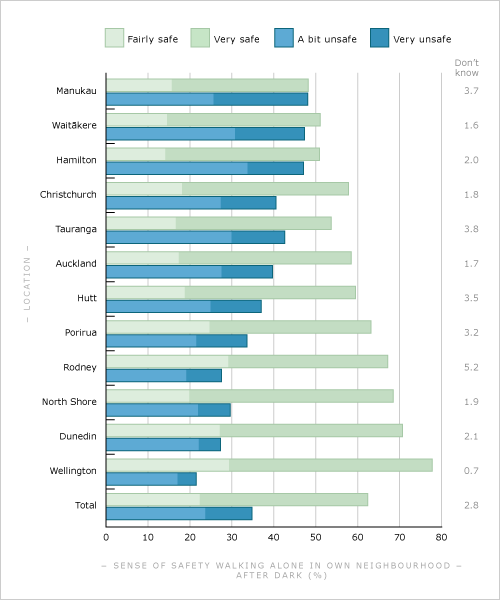
The image size is (500, 600). I want to click on bars, so click(x=237, y=86), click(x=225, y=505).